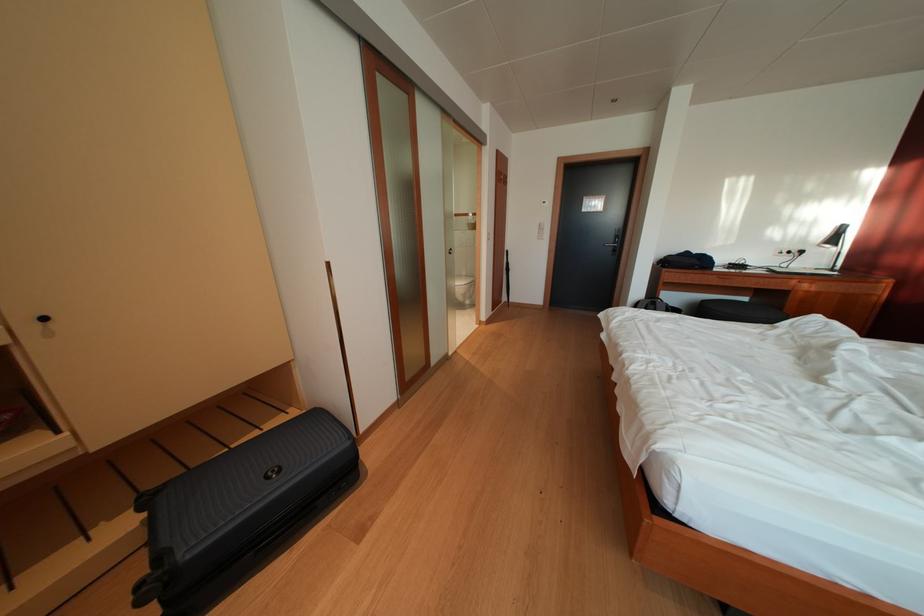
Describe the element at coordinates (43, 318) in the screenshot. I see `the black cabinet knob` at that location.